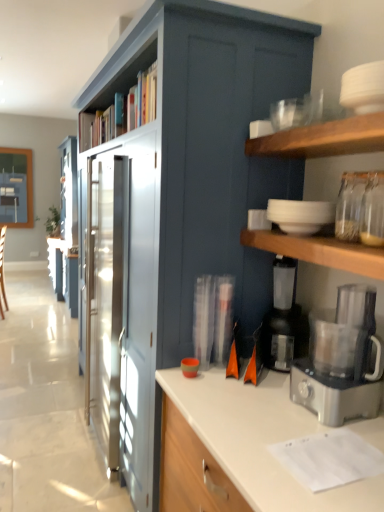
At what (x,y) coordinates should I click in order to perform the action: click on satin blue cabinet at center. Please return your answer as a coordinate pair (x, y). This screenshot has height=512, width=384. Looking at the image, I should click on (x=174, y=203).

Where is `white matte bowls at upper right, the 2th appliance ordered from the bottom`? The width and height of the screenshot is (384, 512). white matte bowls at upper right, the 2th appliance ordered from the bottom is located at coordinates point(300,215).

Describe the element at coordinates (300, 215) in the screenshot. I see `white matte bowls at upper right, the first appliance when ordered from top to bottom` at that location.

Measure the distance between point (152, 52) and camera.

The depth of point (152, 52) is 6.19 feet.

The height and width of the screenshot is (512, 384). Describe the element at coordinates (341, 359) in the screenshot. I see `satin silver food processor at right` at that location.

Where is `satin blue cabinet at center`? The height and width of the screenshot is (512, 384). satin blue cabinet at center is located at coordinates (174, 203).

Is black plastic coffee maker at lower right, which is the first appliance from bottom to top, smaller than satin blue cabinet at center?

Yes, black plastic coffee maker at lower right, which is the first appliance from bottom to top, is smaller than satin blue cabinet at center.

Considering the relative positions of black plastic coffee maker at lower right, which is the first appliance from bottom to top, and satin blue cabinet at center in the image provided, is black plastic coffee maker at lower right, which is the first appliance from bottom to top, in front of satin blue cabinet at center?

No, the depth of black plastic coffee maker at lower right, which is the first appliance from bottom to top, is greater than that of satin blue cabinet at center.

You are a GUI agent. You are given a task and a screenshot of the screen. Output one action in this format:
    pyautogui.click(x=<x>, y=<y>)
    Task: Click on the 1st appliance to the right when counting from the satin blue cabinet at center
    
    Given the screenshot: What is the action you would take?
    pyautogui.click(x=284, y=320)

What's the angular difference between black plastic coffee maker at lower right, which is the first appliance from bottom to top, and satin blue cabinet at center's facing directions?

2.64 degrees separate the facing orientations of black plastic coffee maker at lower right, which is the first appliance from bottom to top, and satin blue cabinet at center.

From the picture: Is satin blue cabinet at center not inside wooden bookshelf at upper center?

Yes, satin blue cabinet at center is located beyond the bounds of wooden bookshelf at upper center.

Is satin blue cabinet at center positioned far away from wooden bookshelf at upper center?

No, satin blue cabinet at center is not far away from wooden bookshelf at upper center.

Is satin blue cabinet at center in front of or behind wooden bookshelf at upper center in the image?

Visually, satin blue cabinet at center is located in front of wooden bookshelf at upper center.

Considering the sizes of objects satin blue cabinet at center and wooden bookshelf at upper center in the image provided, who is thinner, satin blue cabinet at center or wooden bookshelf at upper center?

With smaller width is wooden bookshelf at upper center.

Can you confirm if black plastic coffee maker at lower right, which is the first appliance from bottom to top, is shorter than white matte bowls at upper right, the first appliance when ordered from top to bottom?

No.

Considering the relative positions of black plastic coffee maker at lower right, which is the first appliance from bottom to top, and white matte bowls at upper right, the first appliance when ordered from top to bottom, in the image provided, is black plastic coffee maker at lower right, which is the first appliance from bottom to top, to the left or to the right of white matte bowls at upper right, the first appliance when ordered from top to bottom,?

In the image, black plastic coffee maker at lower right, which is the first appliance from bottom to top, appears on the left side of white matte bowls at upper right, the first appliance when ordered from top to bottom.

Is black plastic coffee maker at lower right, the second appliance in the top-to-bottom sequence, far from white matte bowls at upper right, the first appliance when ordered from top to bottom?

black plastic coffee maker at lower right, the second appliance in the top-to-bottom sequence, is near white matte bowls at upper right, the first appliance when ordered from top to bottom, not far away.

Which is correct: black plastic coffee maker at lower right, the second appliance in the top-to-bottom sequence, is inside white matte bowls at upper right, the 2th appliance ordered from the bottom, or outside of it?

black plastic coffee maker at lower right, the second appliance in the top-to-bottom sequence, is not inside white matte bowls at upper right, the 2th appliance ordered from the bottom, it's outside.

Is satin silver food processor at right shorter than satin blue cabinet at center?

Indeed, satin silver food processor at right has a lesser height compared to satin blue cabinet at center.

In the scene shown: Measure the distance from satin silver food processor at right to satin blue cabinet at center.

They are 34.65 inches apart.

Between satin silver food processor at right and satin blue cabinet at center, which one is positioned in front?

satin silver food processor at right.

From their relative heights in the image, would you say wooden bookshelf at upper center is taller or shorter than satin blue cabinet at center?

Considering their sizes, wooden bookshelf at upper center has less height than satin blue cabinet at center.

From the picture: Which of these two, wooden bookshelf at upper center or satin blue cabinet at center, is bigger?

With larger size is satin blue cabinet at center.

Considering the positions of objects wooden bookshelf at upper center and satin blue cabinet at center in the image provided, who is in front, wooden bookshelf at upper center or satin blue cabinet at center?

satin blue cabinet at center is closer to the camera.

Considering the relative positions of wooden bookshelf at upper center and satin blue cabinet at center in the image provided, is wooden bookshelf at upper center to the left or to the right of satin blue cabinet at center?

In the image, wooden bookshelf at upper center appears on the left side of satin blue cabinet at center.

Is wooden bookshelf at upper center directly adjacent to black plastic coffee maker at lower right, the second appliance in the top-to-bottom sequence?

They are not placed beside each other.

This screenshot has height=512, width=384. I want to click on shelf positioned vertically above the black plastic coffee maker at lower right, the second appliance in the top-to-bottom sequence (from a real-world perspective), so click(x=124, y=78).

Can you confirm if wooden bookshelf at upper center is positioned to the left of black plastic coffee maker at lower right, which is the first appliance from bottom to top?

Indeed, wooden bookshelf at upper center is positioned on the left side of black plastic coffee maker at lower right, which is the first appliance from bottom to top.

Can you confirm if wooden bookshelf at upper center is taller than satin silver food processor at right?

Incorrect, the height of wooden bookshelf at upper center is not larger of that of satin silver food processor at right.

Is satin silver food processor at right surrounded by wooden bookshelf at upper center?

Definitely not — satin silver food processor at right is not inside wooden bookshelf at upper center.

Is there a large distance between wooden bookshelf at upper center and satin silver food processor at right?

wooden bookshelf at upper center is positioned a significant distance from satin silver food processor at right.

Considering the points (107, 96) and (368, 403), which point is behind, point (107, 96) or point (368, 403)?

The point (107, 96) is behind.

At what (x,y) coordinates should I click in order to perform the action: click on cabinetry on the left of black plastic coffee maker at lower right, which is the first appliance from bottom to top. Please return your answer as a coordinate pair (x, y). The width and height of the screenshot is (384, 512). Looking at the image, I should click on (174, 203).

I want to click on cabinetry in front of the wooden bookshelf at upper center, so click(x=174, y=203).

When comparing their distances from satin silver food processor at right, does black plastic coffee maker at lower right, the second appliance in the top-to-bottom sequence, or white matte bowls at upper right, the 2th appliance ordered from the bottom, seem further?

white matte bowls at upper right, the 2th appliance ordered from the bottom, is positioned further to the anchor satin silver food processor at right.

Considering their positions, is wooden bookshelf at upper center positioned closer to white matte bowls at upper right, the first appliance when ordered from top to bottom, than black plastic coffee maker at lower right, which is the first appliance from bottom to top?

black plastic coffee maker at lower right, which is the first appliance from bottom to top, lies closer to white matte bowls at upper right, the first appliance when ordered from top to bottom, than the other object.

When comparing their distances from satin silver food processor at right, does black plastic coffee maker at lower right, which is the first appliance from bottom to top, or satin blue cabinet at center seem closer?

black plastic coffee maker at lower right, which is the first appliance from bottom to top, is positioned closer to the anchor satin silver food processor at right.

Based on their spatial positions, is white matte bowls at upper right, the 2th appliance ordered from the bottom, or wooden bookshelf at upper center closer to satin silver food processor at right?

Based on the image, white matte bowls at upper right, the 2th appliance ordered from the bottom, appears to be nearer to satin silver food processor at right.

From the picture: From the image, which object appears to be farther from wooden bookshelf at upper center, satin blue cabinet at center or black plastic coffee maker at lower right, the second appliance in the top-to-bottom sequence?

black plastic coffee maker at lower right, the second appliance in the top-to-bottom sequence.

Based on their spatial positions, is satin silver food processor at right or white matte bowls at upper right, the first appliance when ordered from top to bottom, closer to black plastic coffee maker at lower right, the second appliance in the top-to-bottom sequence?

Among the two, satin silver food processor at right is located nearer to black plastic coffee maker at lower right, the second appliance in the top-to-bottom sequence.

Looking at the image, which one is located closer to black plastic coffee maker at lower right, the second appliance in the top-to-bottom sequence, satin silver food processor at right or wooden bookshelf at upper center?

satin silver food processor at right is closer to black plastic coffee maker at lower right, the second appliance in the top-to-bottom sequence.

Based on their spatial positions, is black plastic coffee maker at lower right, the second appliance in the top-to-bottom sequence, or satin silver food processor at right further from white matte bowls at upper right, the 2th appliance ordered from the bottom?

Based on the image, satin silver food processor at right appears to be further to white matte bowls at upper right, the 2th appliance ordered from the bottom.

Where is `cabinetry between wooden bookshelf at upper center and satin silver food processor at right in the up-down direction`? The width and height of the screenshot is (384, 512). cabinetry between wooden bookshelf at upper center and satin silver food processor at right in the up-down direction is located at coordinates (174, 203).

The width and height of the screenshot is (384, 512). I want to click on cabinetry between wooden bookshelf at upper center and black plastic coffee maker at lower right, the second appliance in the top-to-bottom sequence, in the vertical direction, so click(174, 203).

Locate an element on the screen. The height and width of the screenshot is (512, 384). appliance between satin blue cabinet at center and white matte bowls at upper right, the 2th appliance ordered from the bottom is located at coordinates (284, 320).

Locate an element on the screen. appliance between white matte bowls at upper right, the first appliance when ordered from top to bottom, and satin silver food processor at right vertically is located at coordinates (284, 320).